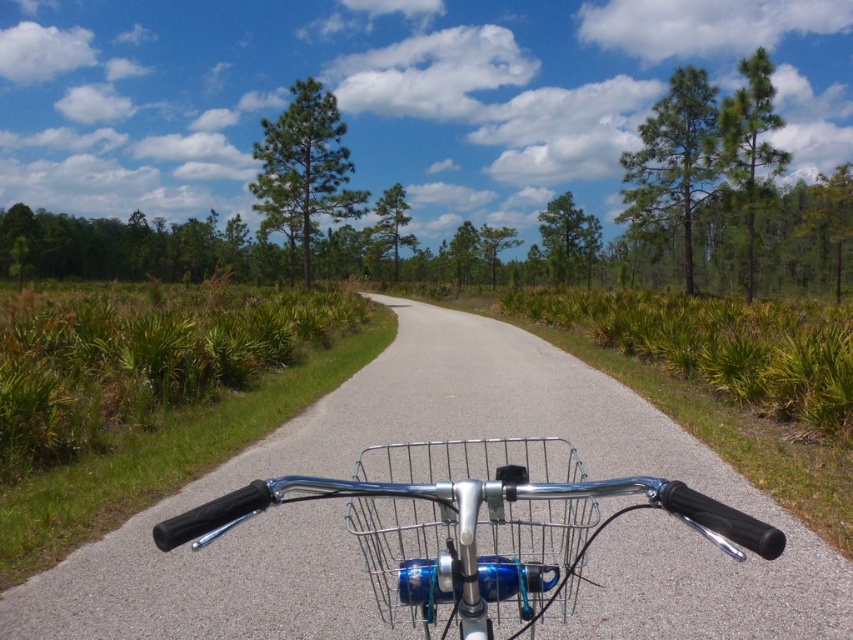
Question: Does polished chrome bicycle handlebars at center have a greater width compared to silver wire basket at center?

Choices:
 (A) no
 (B) yes

Answer: (B)

Question: Is metallic asphalt road at center wider than polished chrome bicycle handlebars at center?

Choices:
 (A) yes
 (B) no

Answer: (A)

Question: Among these points, which one is farthest from the camera?

Choices:
 (A) (445, 577)
 (B) (427, 456)

Answer: (B)

Question: Is metallic asphalt road at center thinner than silver wire basket at center?

Choices:
 (A) yes
 (B) no

Answer: (B)

Question: Which point is closer to the camera?

Choices:
 (A) (350, 528)
 (B) (384, 550)

Answer: (B)

Question: Which of the following is the closest to the observer?

Choices:
 (A) metallic asphalt road at center
 (B) polished chrome bicycle handlebars at center
 (C) silver wire basket at center

Answer: (C)